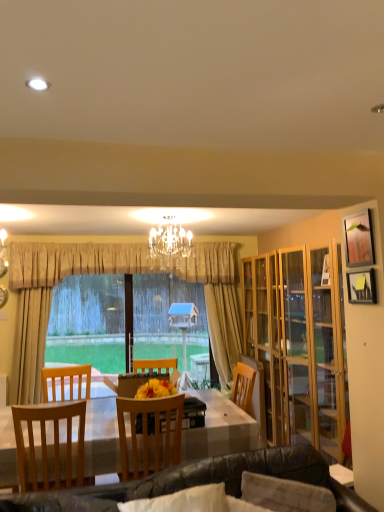
Where is `vacant space situated above crystal chandelier at center (from a real-world perspective)`? The image size is (384, 512). vacant space situated above crystal chandelier at center (from a real-world perspective) is located at coordinates (169, 217).